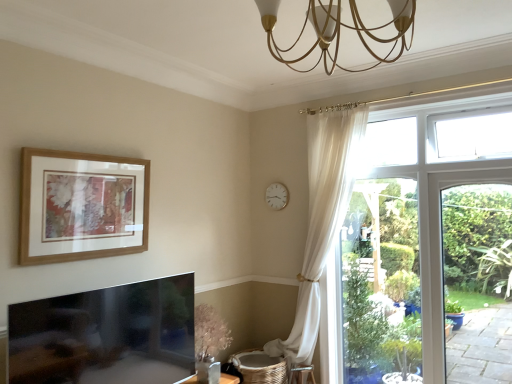
Question: Is white plastic clock at upper center at the back of wooden picture frame at upper left?

Choices:
 (A) yes
 (B) no

Answer: (B)

Question: Can you confirm if wooden picture frame at upper left is taller than white plastic clock at upper center?

Choices:
 (A) yes
 (B) no

Answer: (A)

Question: Considering the relative positions of wooden picture frame at upper left and white plastic clock at upper center in the image provided, is wooden picture frame at upper left to the right of white plastic clock at upper center from the viewer's perspective?

Choices:
 (A) yes
 (B) no

Answer: (B)

Question: Can you confirm if wooden picture frame at upper left is shorter than white plastic clock at upper center?

Choices:
 (A) no
 (B) yes

Answer: (A)

Question: From a real-world perspective, is wooden picture frame at upper left over white plastic clock at upper center?

Choices:
 (A) yes
 (B) no

Answer: (B)

Question: Is wooden picture frame at upper left to the left or to the right of gold metallic chandelier at upper center in the image?

Choices:
 (A) left
 (B) right

Answer: (A)

Question: Considering the positions of wooden picture frame at upper left and gold metallic chandelier at upper center in the image, is wooden picture frame at upper left bigger or smaller than gold metallic chandelier at upper center?

Choices:
 (A) big
 (B) small

Answer: (B)

Question: In terms of height, does wooden picture frame at upper left look taller or shorter compared to gold metallic chandelier at upper center?

Choices:
 (A) tall
 (B) short

Answer: (A)

Question: Is wooden picture frame at upper left in front of or behind gold metallic chandelier at upper center in the image?

Choices:
 (A) behind
 (B) front

Answer: (A)

Question: Is point (369, 31) positioned closer to the camera than point (131, 231)?

Choices:
 (A) closer
 (B) farther

Answer: (A)

Question: Considering the positions of gold metallic chandelier at upper center and wooden picture frame at upper left in the image, is gold metallic chandelier at upper center bigger or smaller than wooden picture frame at upper left?

Choices:
 (A) big
 (B) small

Answer: (A)

Question: From a real-world perspective, is gold metallic chandelier at upper center above or below wooden picture frame at upper left?

Choices:
 (A) below
 (B) above

Answer: (B)

Question: Do you think gold metallic chandelier at upper center is within wooden picture frame at upper left, or outside of it?

Choices:
 (A) inside
 (B) outside

Answer: (B)

Question: From the image's perspective, is white plastic clock at upper center positioned above or below gold metallic chandelier at upper center?

Choices:
 (A) above
 (B) below

Answer: (B)

Question: In the image, is white plastic clock at upper center on the left side or the right side of gold metallic chandelier at upper center?

Choices:
 (A) left
 (B) right

Answer: (A)